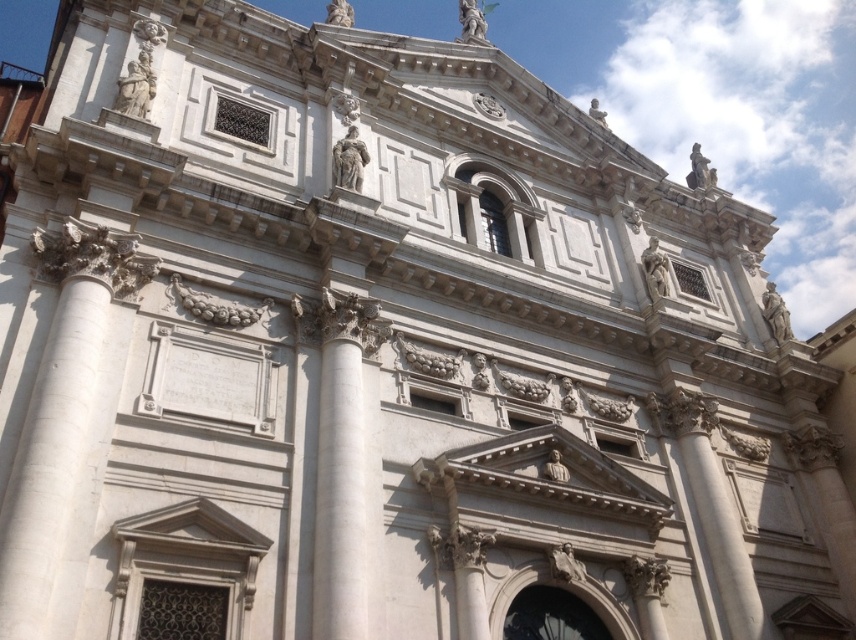
In the scene shown: You are an architect analyzing the facade of this classical building. You notice two points marked on the image at coordinates point (1,634) and point (317,580). Which of these points is positioned closer to the viewer?

Point (1,634) is closer to the viewer than point (317,580).